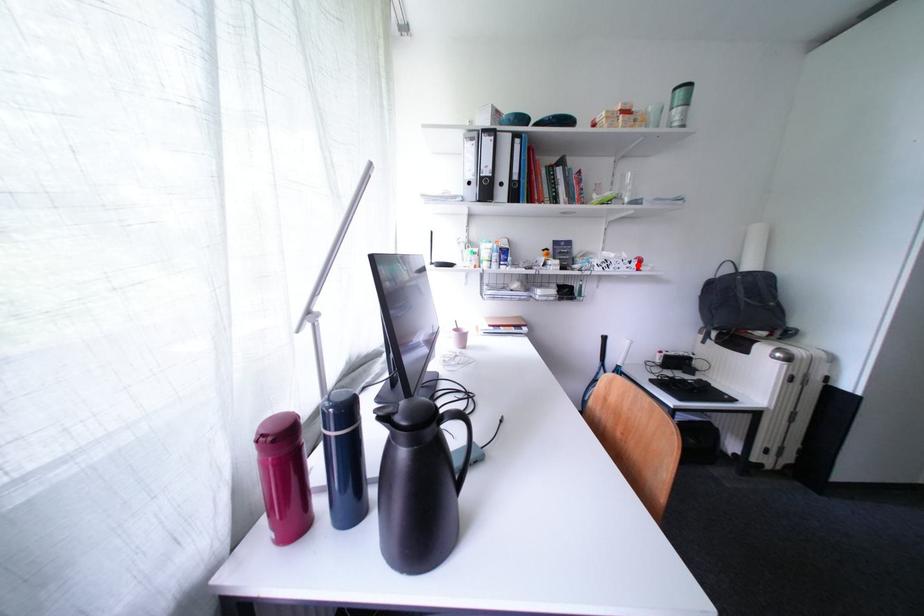
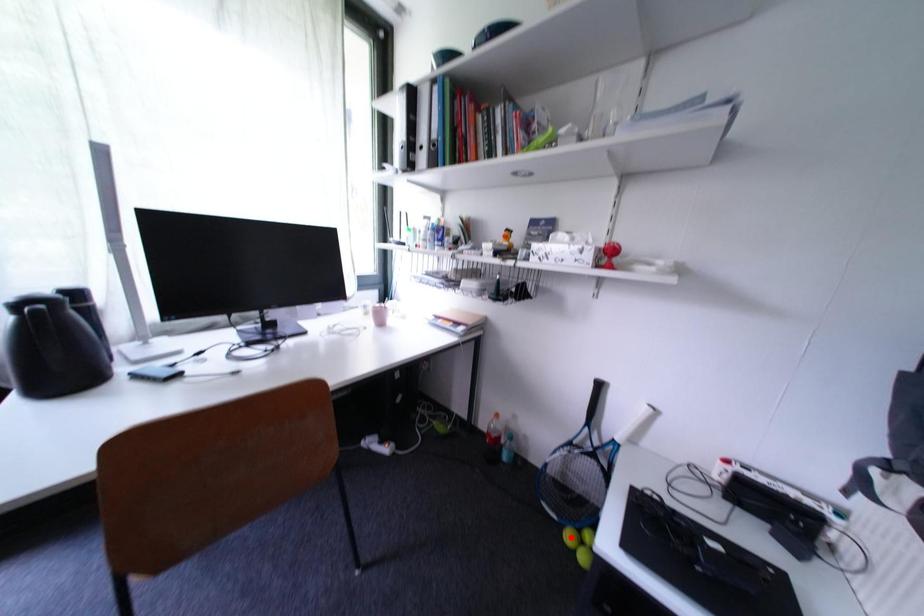
I am providing you with two images of the same scene from different viewpoints. A red point is marked on the first image and another point is marked on the second image. Are the points marked in image1 and image2 representing the same 3D position?

No